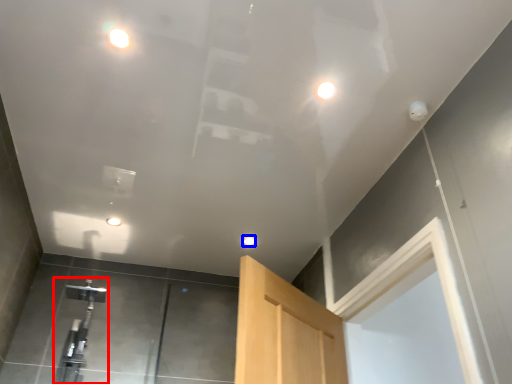
Question: Which of the following is the farthest to the observer, faucet (highlighted by a red box) or droplight (highlighted by a blue box)?

Choices:
 (A) faucet
 (B) droplight

Answer: (B)